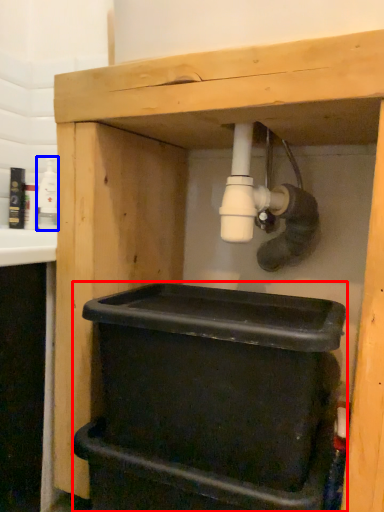
Question: Which object is further to the camera taking this photo, recycling bin (highlighted by a red box) or bottle (highlighted by a blue box)?

Choices:
 (A) recycling bin
 (B) bottle

Answer: (B)